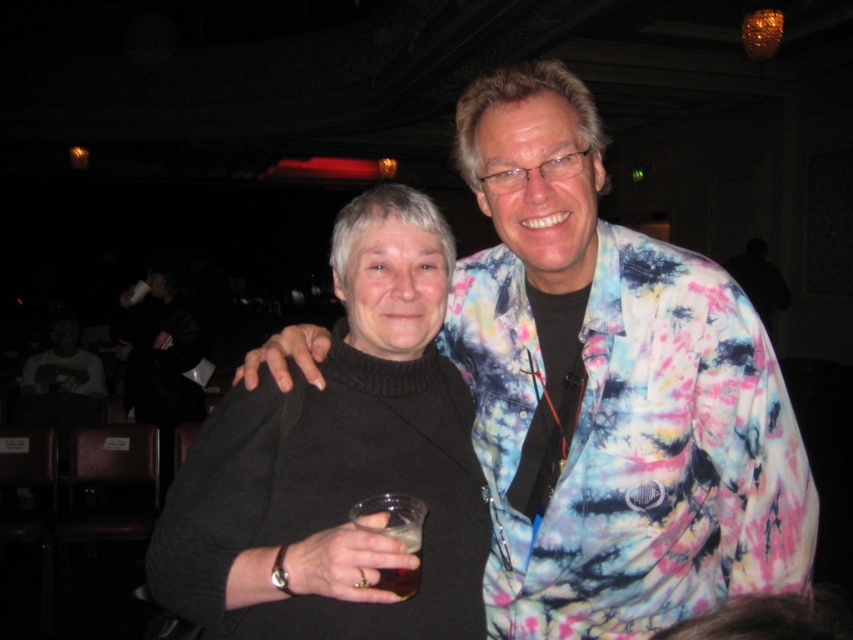
You are a photographer who needs to adjust the lighting between the black sweater at center and the translucent glass at lower center. Given the distance between them, can you estimate if the lighting setup will require a single light source or multiple sources to evenly illuminate both objects?

The distance between the black sweater at center and the translucent glass at lower center is 8.56 inches. A single light source might suffice if positioned appropriately to cover both objects within this proximity, but multiple sources could ensure even illumination depending on the light intensity and spread.